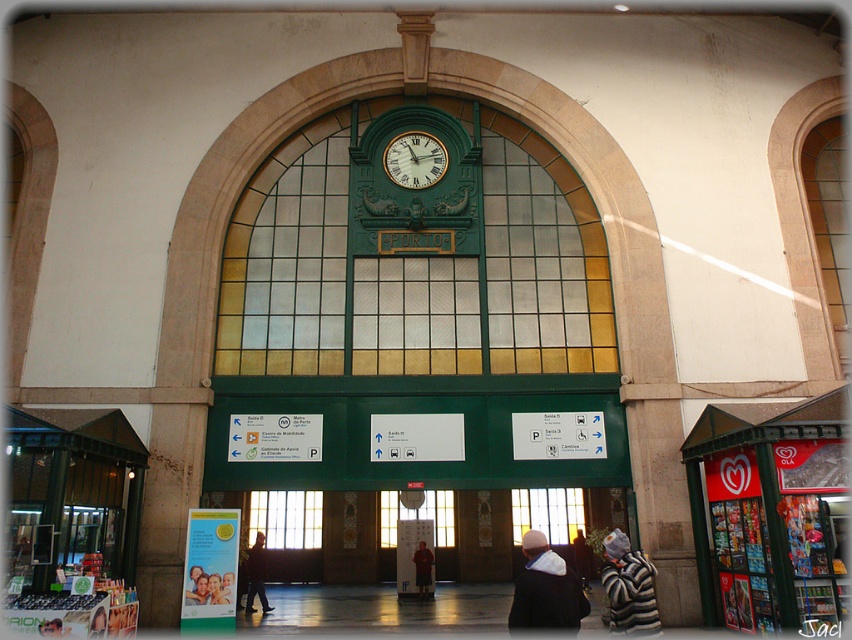
You are standing in the train station and see two points marked on the wall. The first point is at coordinate point (517, 609) and the second is at point (394, 509). If you want to move from the first point to the second point, which direction should you move relative to your current position?

To move from point (517, 609) to point (394, 509), you should move diagonally towards the upper left direction since point (394, 509) is located in front of point (517, 609).

You are a traveler who just arrived at the station and see the green metal clock at center and the dark brown leather jacket at center. Which object is closer to you?

The green metal clock at center is closer to you because it is in front of the dark brown leather jacket at center.

Consider the image. You are standing in the train station and need to reach the translucent glass window at center to check the schedule. The metallic green vending machine at center is blocking your path. Can you walk around it if you have 20 meters of space available?

The distance between the metallic green vending machine at center and the translucent glass window at center is 17.86 meters. Since you have 20 meters of space available, you can walk around the metallic green vending machine at center and reach the translucent glass window at center.